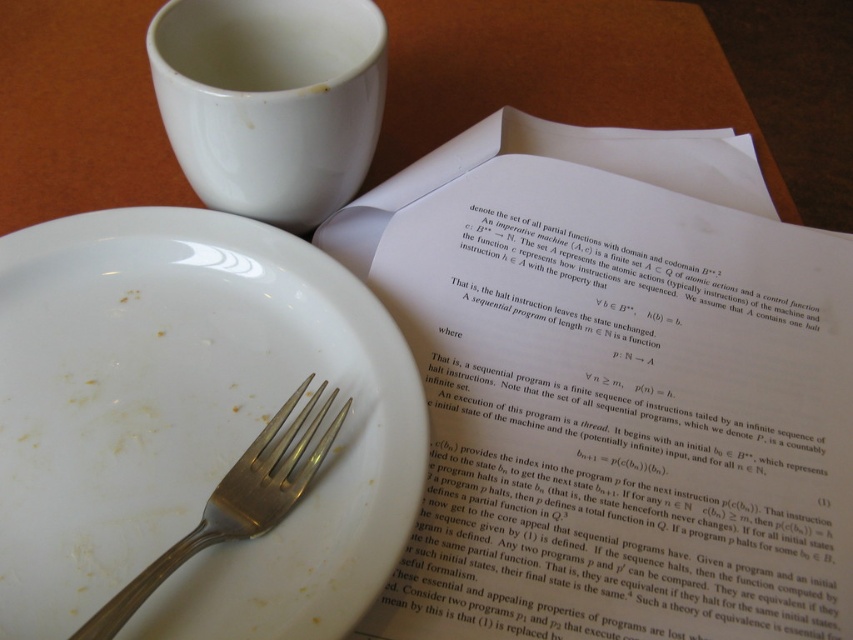
The width and height of the screenshot is (853, 640). What do you see at coordinates (190, 424) in the screenshot?
I see `white glossy plate at lower left` at bounding box center [190, 424].

Locate an element on the screen. white glossy plate at lower left is located at coordinates (190, 424).

Who is positioned more to the right, white glossy plate at lower left or white glossy mug at upper center?

Positioned to the right is white glossy mug at upper center.

Does point (138, 301) lie in front of point (323, 20)?

Yes, it is.

Where is `white glossy plate at lower left`? Image resolution: width=853 pixels, height=640 pixels. white glossy plate at lower left is located at coordinates (190, 424).

Is white paper at upper center to the left of white glossy mug at upper center from the viewer's perspective?

No, white paper at upper center is not to the left of white glossy mug at upper center.

Which of these two, white paper at upper center or white glossy mug at upper center, stands shorter?

white glossy mug at upper center

Is point (697, 348) more distant than point (244, 150)?

That is True.

Where is `white paper at upper center`? This screenshot has height=640, width=853. white paper at upper center is located at coordinates (614, 388).